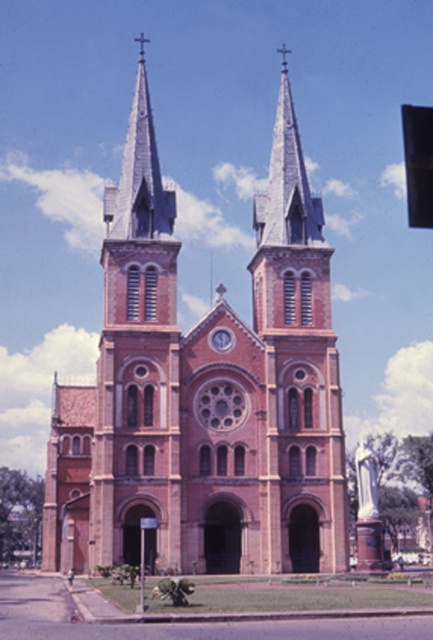
You are standing in front of the historic church and want to take a photo of the smooth gray steeple at center. If your camera can focus on objects up to 75 meters away, will it be able to capture the steeple clearly?

The smooth gray steeple at center is 74.68 meters away from the viewer. Since the camera can focus up to 75 meters, it will be able to capture the steeple clearly as the distance is within the camera range.